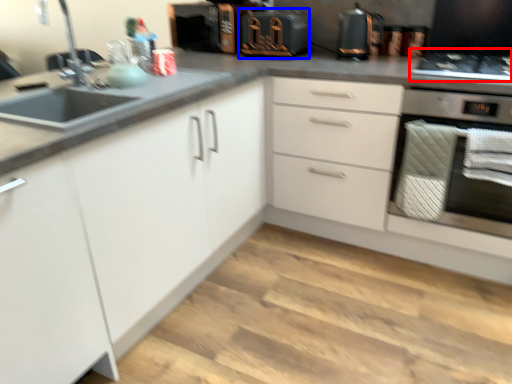
Question: Which point is further to the camera, gas stove (highlighted by a red box) or appliance (highlighted by a blue box)?

Choices:
 (A) gas stove
 (B) appliance

Answer: (B)